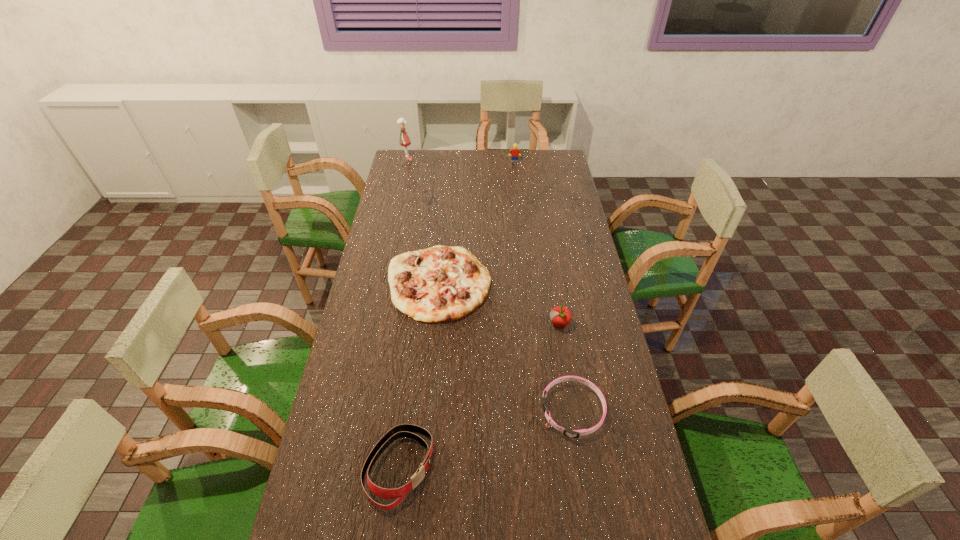
Locate an element on the screen. apple that is at the right edge is located at coordinates (561, 316).

Locate an element on the screen. dog collar located at the right edge is located at coordinates (569, 433).

The height and width of the screenshot is (540, 960). I want to click on object at the far left corner, so click(x=404, y=140).

You are a GUI agent. You are given a task and a screenshot of the screen. Output one action in this format:
    pyautogui.click(x=<x>, y=<y>)
    Task: Click on the vacant space at the far edge of the desktop
    The width and height of the screenshot is (960, 540).
    Given the screenshot: What is the action you would take?
    pyautogui.click(x=499, y=162)

This screenshot has width=960, height=540. Find the location of `blank space at the left edge of the desktop`. blank space at the left edge of the desktop is located at coordinates (411, 192).

Find the location of a particular element. free location at the right edge is located at coordinates (642, 451).

Where is `vacant space at the far right corner of the desktop`? This screenshot has width=960, height=540. vacant space at the far right corner of the desktop is located at coordinates (560, 167).

Find the location of a particular element. The height and width of the screenshot is (540, 960). free space between the right dog collar and the pizza is located at coordinates (506, 347).

This screenshot has width=960, height=540. Identify the location of vacant space that's between the pizza and the third shortest object. (419, 375).

The height and width of the screenshot is (540, 960). In order to click on vacant region between the third shortest object and the doll in this screenshot , I will do `click(403, 314)`.